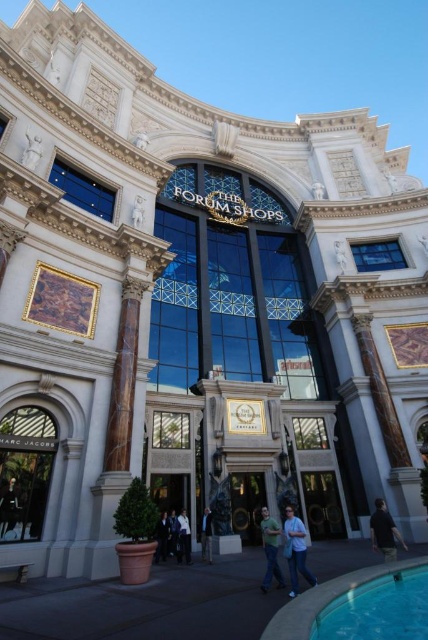
Question: Among these points, which one is farthest from the camera?

Choices:
 (A) (309, 576)
 (B) (181, 536)

Answer: (B)

Question: Does wooden door at center have a smaller size compared to light blue denim jacket at center?

Choices:
 (A) yes
 (B) no

Answer: (B)

Question: Among these points, which one is nearest to the camera?

Choices:
 (A) tap(272, 564)
 (B) tap(205, 547)
 (C) tap(380, 541)
 (D) tap(302, 547)

Answer: (D)

Question: Does marble column at left come behind dark blue jacket at center?

Choices:
 (A) no
 (B) yes

Answer: (A)

Question: Based on their relative distances, which object is farther from the light blue shirt at center?

Choices:
 (A) light blue denim jacket at center
 (B) wooden door at center
 (C) marble column at left
 (D) blue denim jeans at lower center

Answer: (D)

Question: Does blue denim jeans at lower center have a larger size compared to light blue denim jacket at center?

Choices:
 (A) yes
 (B) no

Answer: (A)